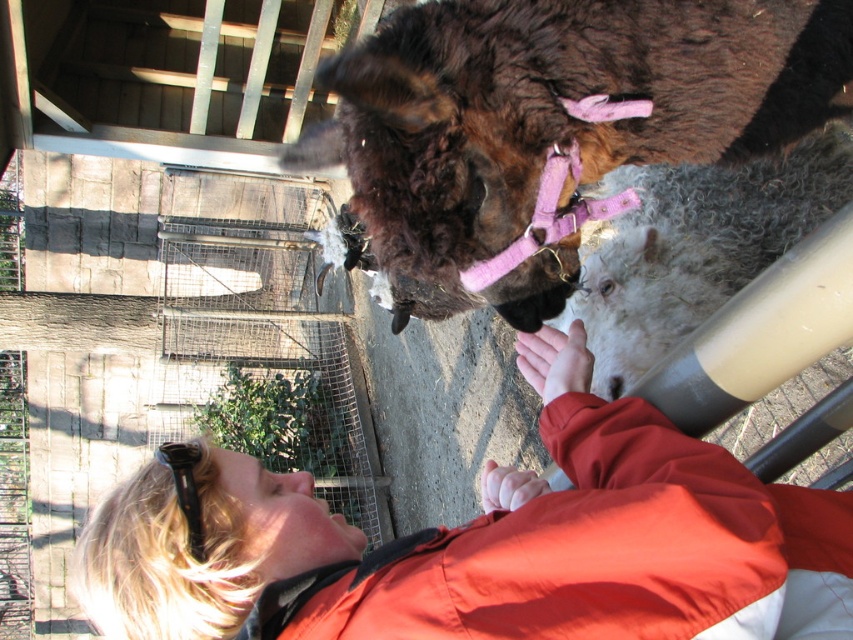
From the picture: Is blonde hair at upper left taller than brown fuzzy llama at upper center?

No.

Is blonde hair at upper left shorter than brown fuzzy llama at upper center?

Yes.

Is point (709, 557) less distant than point (384, 35)?

Yes, it is.

The height and width of the screenshot is (640, 853). What are the coordinates of `blonde hair at upper left` in the screenshot? It's located at (488, 544).